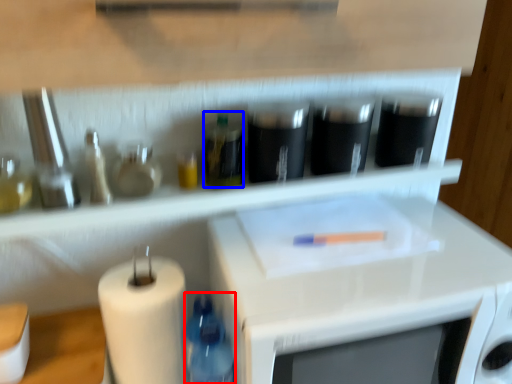
Question: Among these objects, which one is nearest to the camera, bottle (highlighted by a red box) or bottle (highlighted by a blue box)?

Choices:
 (A) bottle
 (B) bottle

Answer: (A)